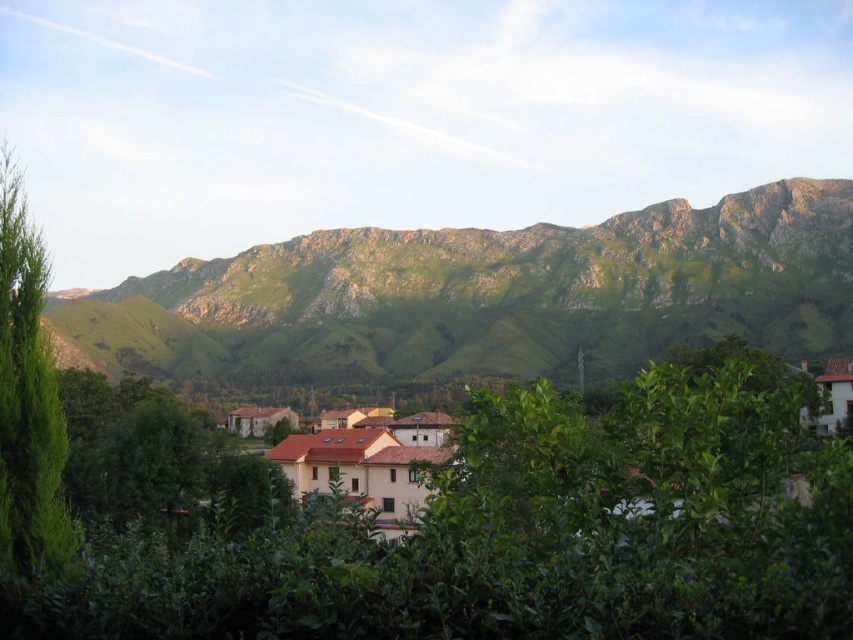
Does green rocky mountain range at upper center have a greater width compared to green leafy tree at left?

Correct, the width of green rocky mountain range at upper center exceeds that of green leafy tree at left.

Image resolution: width=853 pixels, height=640 pixels. Describe the element at coordinates (488, 294) in the screenshot. I see `green rocky mountain range at upper center` at that location.

Locate an element on the screen. green rocky mountain range at upper center is located at coordinates (488, 294).

In the scene shown: Between green leafy tree at left and brown tiled houses at center, which one appears on the left side from the viewer's perspective?

From the viewer's perspective, green leafy tree at left appears more on the left side.

Is green leafy tree at left to the right of brown tiled houses at center from the viewer's perspective?

No, green leafy tree at left is not to the right of brown tiled houses at center.

Is point (32, 285) farther from camera compared to point (395, 524)?

No, it is in front of (395, 524).

Image resolution: width=853 pixels, height=640 pixels. Find the location of `green leafy tree at left`. green leafy tree at left is located at coordinates (28, 400).

Is green rocky mountain range at upper center to the right of brown tiled houses at center from the viewer's perspective?

No, green rocky mountain range at upper center is not to the right of brown tiled houses at center.

Between green rocky mountain range at upper center and brown tiled houses at center, which one has more height?

green rocky mountain range at upper center is taller.

Which is in front, point (785, 339) or point (376, 451)?

Point (376, 451) is in front.

Where is `green rocky mountain range at upper center`? This screenshot has height=640, width=853. green rocky mountain range at upper center is located at coordinates coord(488,294).